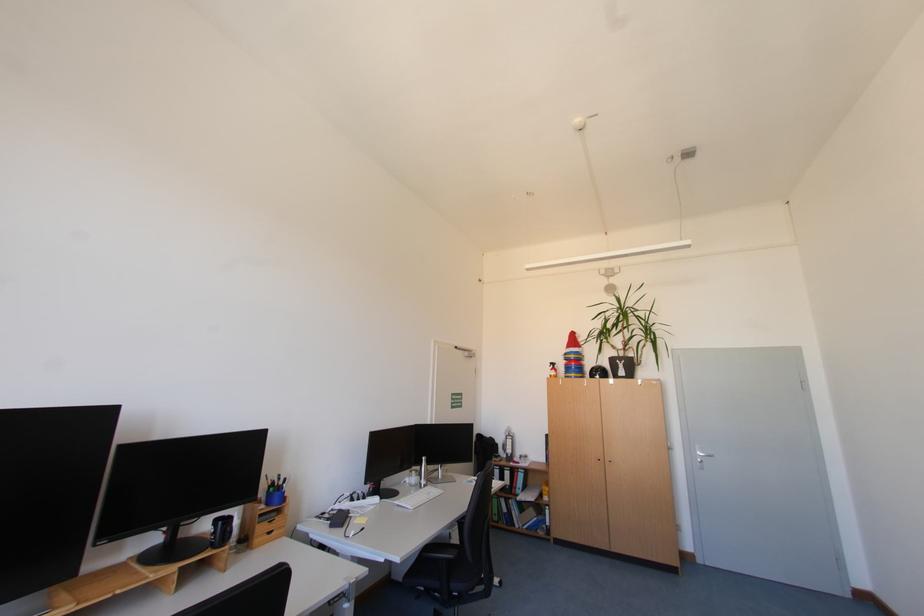
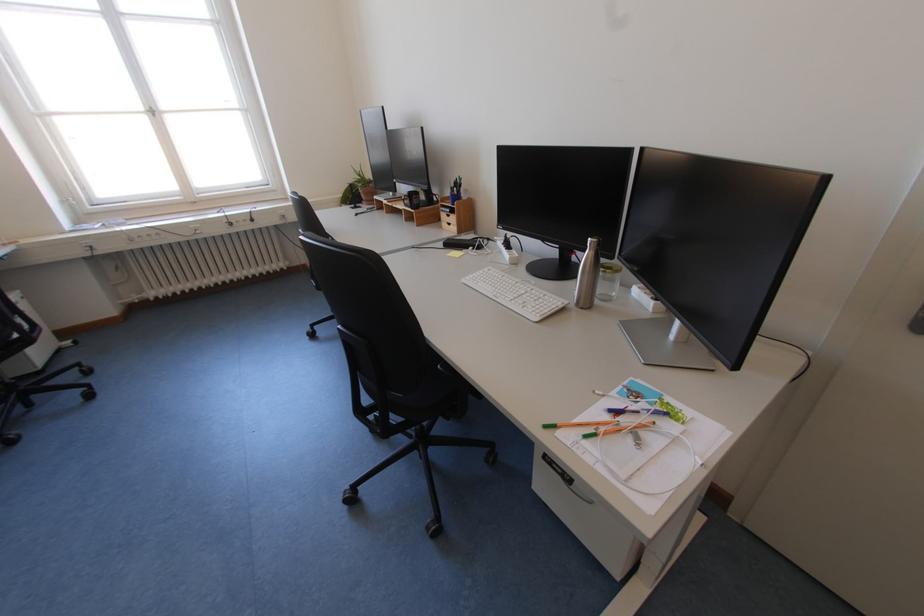
Locate, in the second image, the point that corresponds to the point at 432,459 in the first image.

(599, 240)